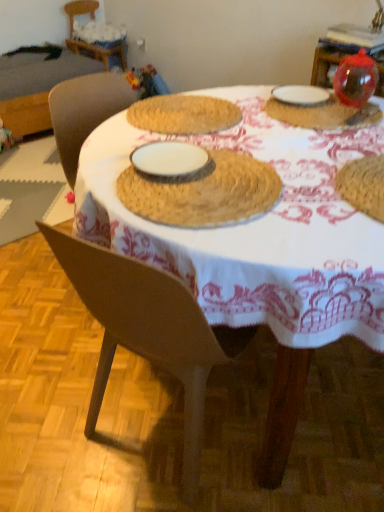
You are a GUI agent. You are given a task and a screenshot of the screen. Output one action in this format:
    pyautogui.click(x=<x>, y=<y>)
    Task: Click on the free space in front of transparent plastic ornament at upper right, the third tableware from the left
    
    Given the screenshot: What is the action you would take?
    pyautogui.click(x=350, y=119)